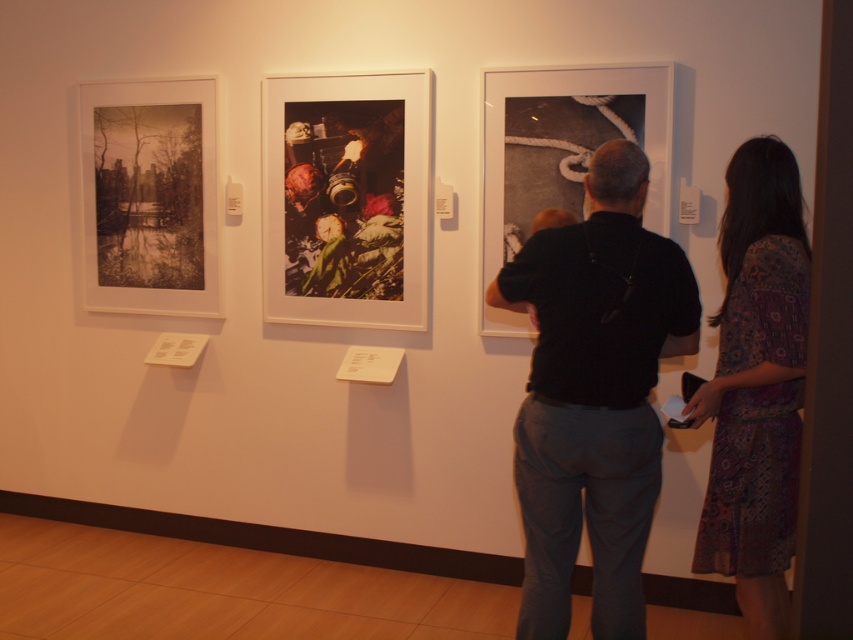
You are an interior designer arranging items on a shelf. You have a printed cotton dress at right and a shiny metallic camera at center. According to the scene, where should you place the printed cotton dress relative to the shiny metallic camera?

The printed cotton dress at right should be placed below the shiny metallic camera at center as per the scene description.